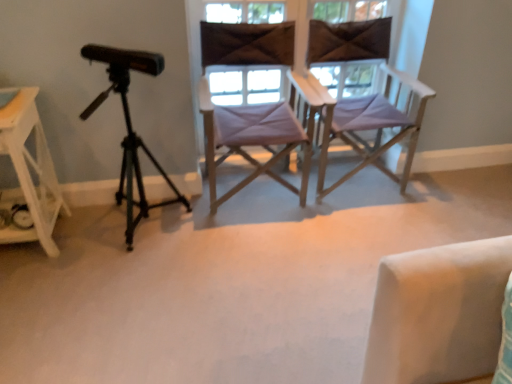
This screenshot has height=384, width=512. Find the location of `free space in front of purple fabric chair at center, placed as the first chair when sorted from right to left`. free space in front of purple fabric chair at center, placed as the first chair when sorted from right to left is located at coordinates (350, 241).